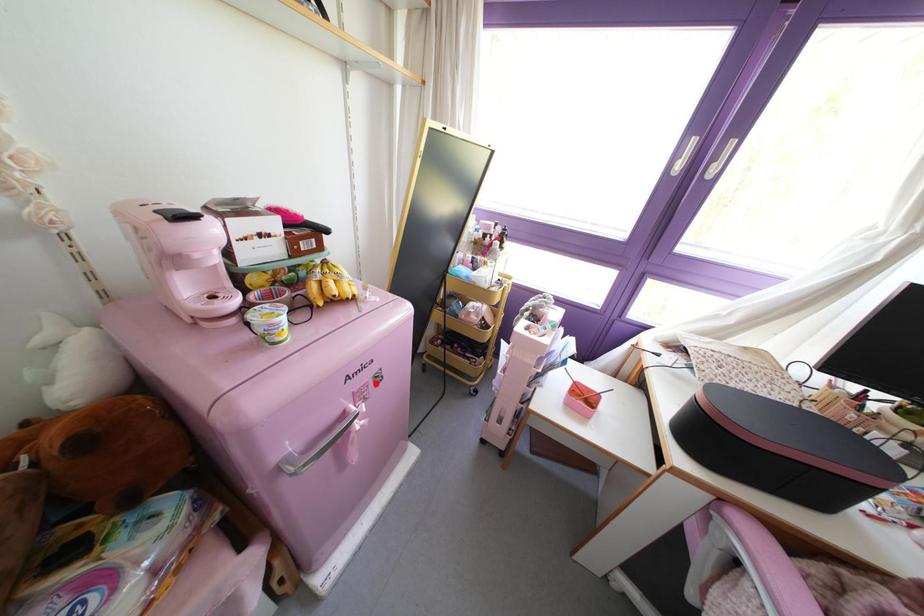
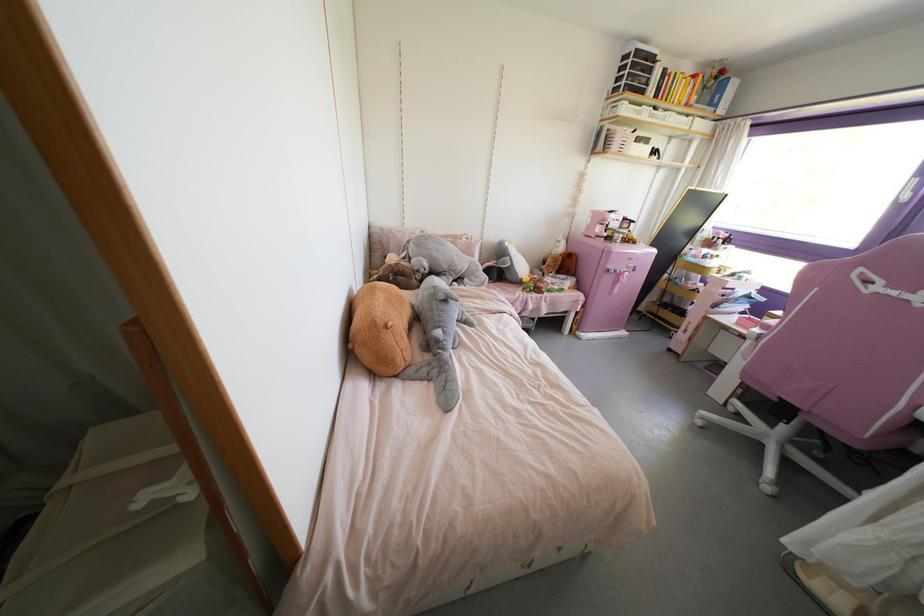
Where in the second image is the point corresponding to the highlighted location from the first image?

(633, 270)